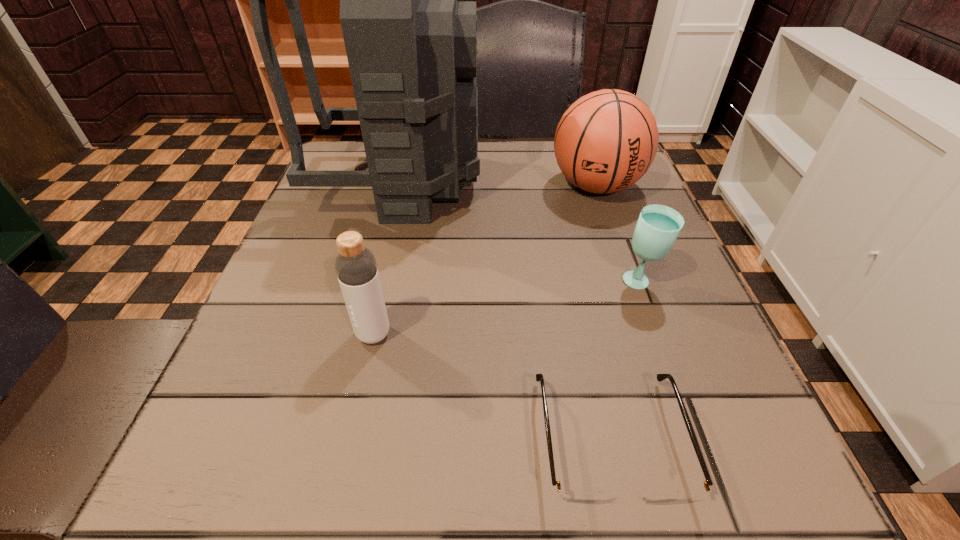
Identify the location of backpack. The image size is (960, 540). point(411,46).

The height and width of the screenshot is (540, 960). Identify the location of basketball. (606, 141).

Find the location of a particular element. bottle is located at coordinates (355, 265).

Locate an element on the screen. The width and height of the screenshot is (960, 540). the fourth tallest object is located at coordinates (658, 226).

Identify the location of glass. (x=658, y=226).

In order to click on the nearest object in this screenshot , I will do `click(575, 495)`.

Find the location of a particular element. the shortest object is located at coordinates (575, 495).

Locate an element on the screen. This screenshot has width=960, height=540. vacant region located 0.130m on the front compartment of the tallest object is located at coordinates (537, 183).

This screenshot has width=960, height=540. Identify the location of vacant space located on the surface of the basketball near the brand logo. (615, 240).

Locate an element on the screen. This screenshot has width=960, height=540. free space located 0.340m on the right of the bottle is located at coordinates (606, 334).